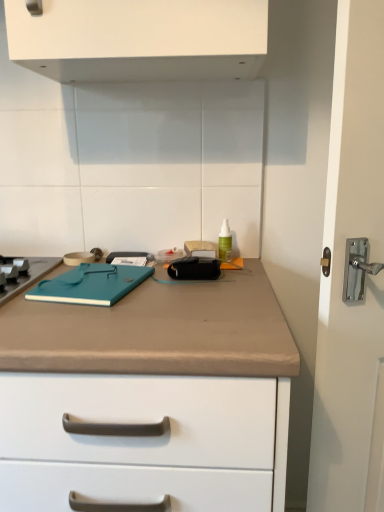
You are a GUI agent. You are given a task and a screenshot of the screen. Output one action in this format:
    pyautogui.click(x=<x>, y=<y>)
    Task: Click on the empty space that is ontop of teal matte notebook at center (from a real-world perspective)
    
    Given the screenshot: What is the action you would take?
    pyautogui.click(x=101, y=276)